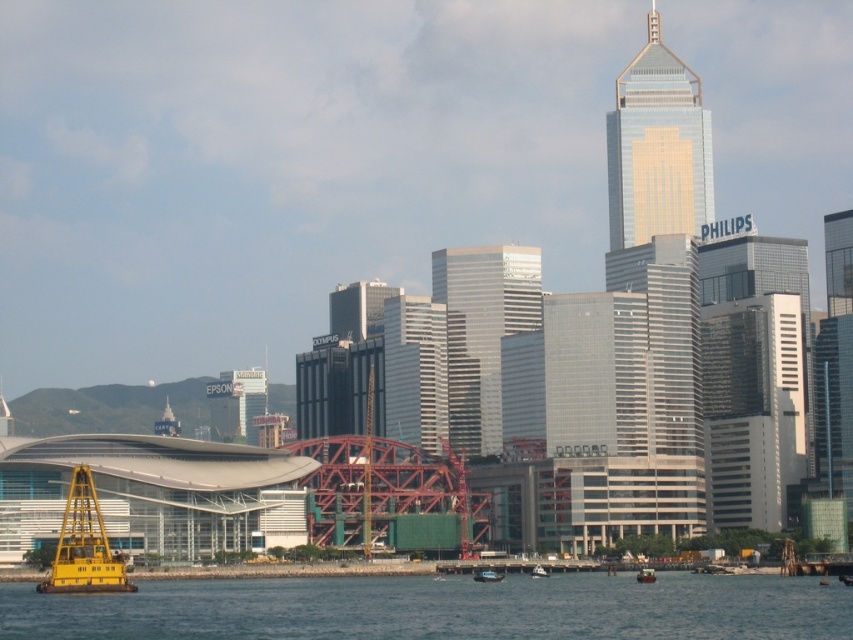
What do you see at coordinates (486, 576) in the screenshot? I see `metallic blue boat at center` at bounding box center [486, 576].

Between metallic blue boat at center and white plastic boat at center, which one appears on the right side from the viewer's perspective?

white plastic boat at center

Which is behind, point (491, 579) or point (546, 570)?

Point (546, 570)

The image size is (853, 640). What are the coordinates of `metallic blue boat at center` in the screenshot? It's located at [x=486, y=576].

Who is taller, gold glass skyscraper at upper right or white plastic boat at center?

gold glass skyscraper at upper right is taller.

Does gold glass skyscraper at upper right appear on the right side of white plastic boat at center?

Yes, gold glass skyscraper at upper right is to the right of white plastic boat at center.

Does point (659, 17) come farther from viewer compared to point (532, 570)?

Yes, it is behind point (532, 570).

Where is `gold glass skyscraper at upper right`? gold glass skyscraper at upper right is located at coordinates (657, 147).

Can you confirm if glossy glass skyscraper at center is shorter than metallic blue boat at center?

No, glossy glass skyscraper at center is not shorter than metallic blue boat at center.

Is glossy glass skyscraper at center positioned before metallic blue boat at center?

No, it is behind metallic blue boat at center.

Describe the element at coordinates (482, 332) in the screenshot. This screenshot has height=640, width=853. I see `glossy glass skyscraper at center` at that location.

In order to click on glossy glass skyscraper at center in this screenshot , I will do `click(482, 332)`.